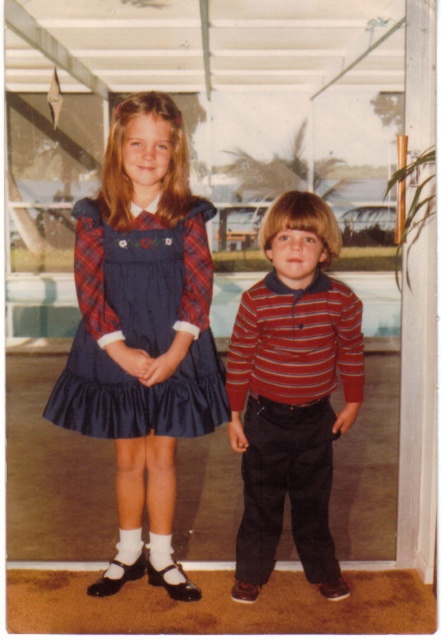
You are an interior designer looking to place a new sofa in the living room. The sofa must be positioned exactly where the matte blue dress at center is currently located. According to the coordinates provided, what are the exact coordinates where you should place the sofa?

The exact coordinates for placing the sofa should be at point (142, 332), as that is the location of the matte blue dress at center.

You are helping organize a clothing donation drive and need to determine which item takes up less space. Based on the image, which item is narrower between the striped cotton shirt at center and the navy satin dress at center?

The striped cotton shirt at center is thinner than the navy satin dress at center, so the striped cotton shirt at center takes up less space and is narrower.